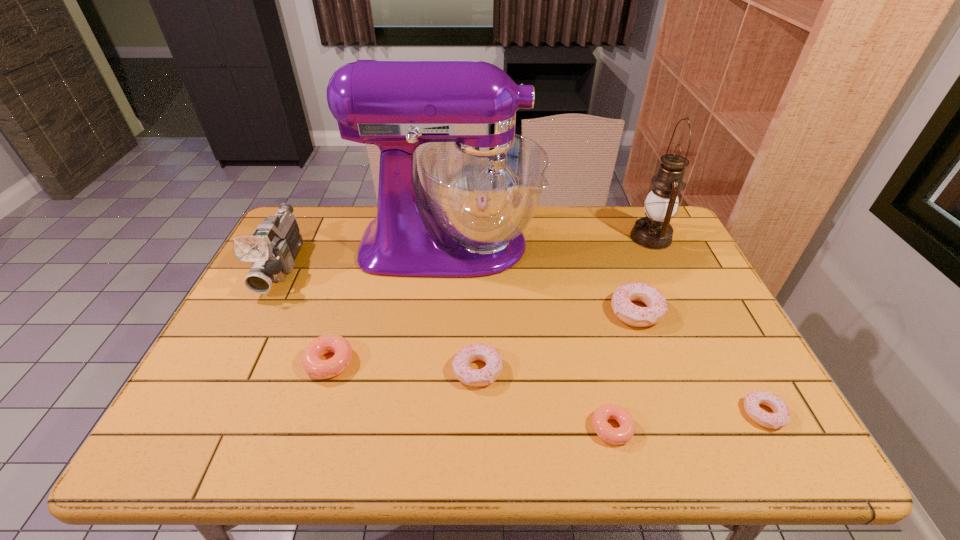
I want to click on the leftmost white doughnut, so click(473, 377).

Find the location of a particular element. Image resolution: width=960 pixels, height=540 pixels. the fourth doughnut from right to left is located at coordinates (473, 377).

This screenshot has height=540, width=960. I want to click on the nearer pink doughnut, so click(617, 436).

Find the location of a particular element. the right pink doughnut is located at coordinates (617, 436).

The image size is (960, 540). Find the location of `the rightmost doughnut`. the rightmost doughnut is located at coordinates (781, 416).

The image size is (960, 540). In order to click on the smallest white doughnut in this screenshot , I will do `click(781, 416)`.

Image resolution: width=960 pixels, height=540 pixels. In order to click on vacant space situated at the bowl opening of the mixer in this screenshot , I will do `click(564, 245)`.

Identify the location of vacant area situated on the left of the seventh shortest object. The width and height of the screenshot is (960, 540). (612, 237).

The image size is (960, 540). Find the location of `free space located on the front-facing side of the camcorder`. free space located on the front-facing side of the camcorder is located at coordinates [x=253, y=323].

Where is `free space located on the left of the farthest white doughnut`? The height and width of the screenshot is (540, 960). free space located on the left of the farthest white doughnut is located at coordinates (544, 312).